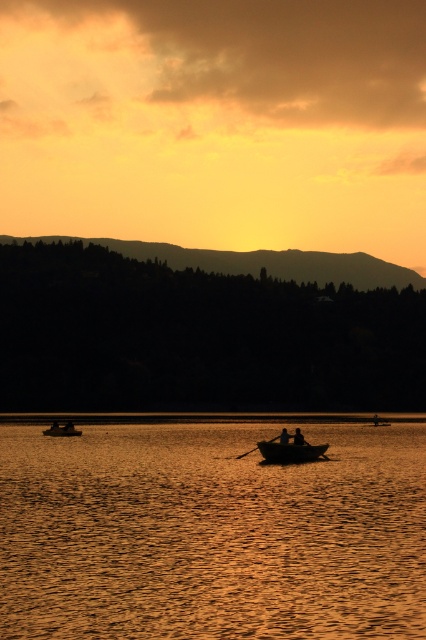
You are standing on a dock and see the golden reflective water at center and the wooden paddle at center. Which object is wider?

The golden reflective water at center is wider than the wooden paddle at center.

You are standing on the shore of the lake and see the golden reflective water at center and the silhouette human at center. Which object is located to the right side of the other?

The silhouette human at center is located to the right side of the golden reflective water at center.

You are standing at the edge of the lake and see the golden reflective water at center and the wooden paddle at center. Which object takes up more space in the image?

The golden reflective water at center takes up more space in the image as it is bigger than the wooden paddle at center.